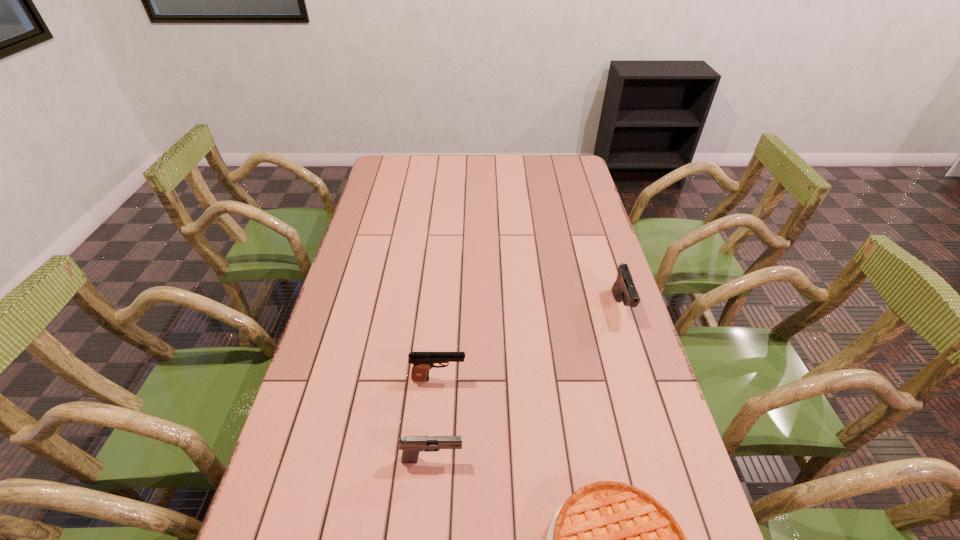
Identify the location of the farthest pistol. This screenshot has height=540, width=960. (624, 290).

At what (x,y) coordinates should I click in order to perform the action: click on the rightmost pistol. Please return your answer as a coordinate pair (x, y). The image size is (960, 540). Looking at the image, I should click on (624, 290).

This screenshot has width=960, height=540. Identify the location of the third nearest object. coord(422,362).

At what (x,y) coordinates should I click in order to perform the action: click on the nearest pistol. Please return your answer as a coordinate pair (x, y). This screenshot has width=960, height=540. Looking at the image, I should click on (411, 445).

I want to click on vacant space located 0.060m at the barrel of the rightmost object, so click(633, 343).

Find the location of a particular element. This screenshot has width=960, height=540. free space located at the barrel of the second farthest object is located at coordinates pyautogui.click(x=592, y=379).

The height and width of the screenshot is (540, 960). Find the location of `free space located aim along the barrel of the second nearest object`. free space located aim along the barrel of the second nearest object is located at coordinates click(539, 459).

Locate an element on the screen. Image resolution: width=960 pixels, height=540 pixels. object that is positioned at the right edge is located at coordinates (624, 290).

You are a GUI agent. You are given a task and a screenshot of the screen. Output one action in this format:
    pyautogui.click(x=<x>, y=<y>)
    Task: Click on the free space at the far edge of the desktop
    Image resolution: width=960 pixels, height=540 pixels.
    Given the screenshot: What is the action you would take?
    pyautogui.click(x=423, y=158)

You are a GUI agent. You are given a task and a screenshot of the screen. Output one action in this format:
    pyautogui.click(x=<x>, y=<y>)
    Task: Click on the free space at the left edge
    This screenshot has width=960, height=540.
    Given the screenshot: What is the action you would take?
    pyautogui.click(x=395, y=251)